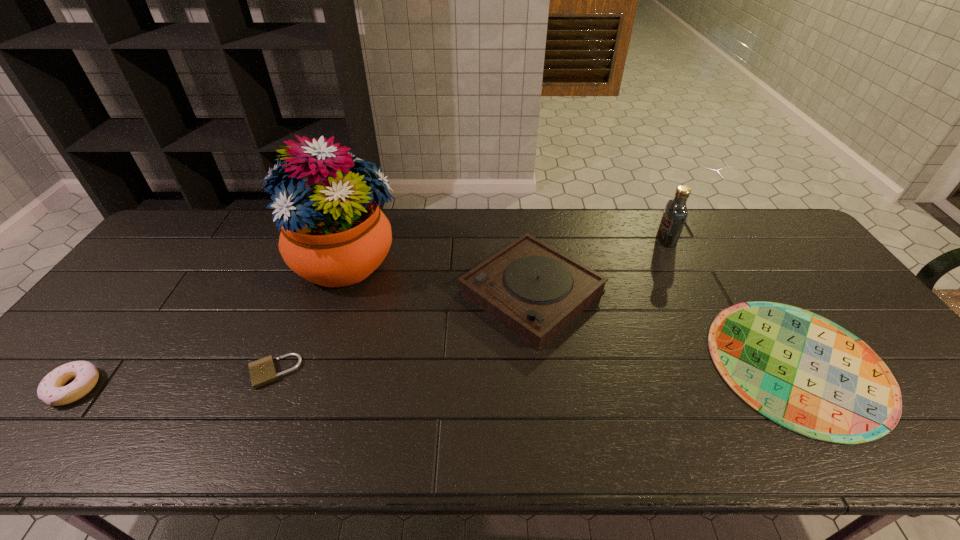
The image size is (960, 540). Identify the location of flower arrangement. (333, 233).

The height and width of the screenshot is (540, 960). What are the coordinates of `vodka` in the screenshot? It's located at (675, 214).

This screenshot has height=540, width=960. In order to click on the third object from right to left in this screenshot , I will do `click(534, 290)`.

You are a GUI agent. You are given a task and a screenshot of the screen. Output one action in this format:
    pyautogui.click(x=<x>, y=<y>)
    Task: Click on the phonograph record
    Image resolution: width=960 pixels, height=540 pixels.
    Given the screenshot: What is the action you would take?
    pyautogui.click(x=534, y=290)

Locate an element on the screen. doughnut is located at coordinates (51, 390).

Identify the location of the leftmost object. (51, 390).

The height and width of the screenshot is (540, 960). What are the coordinates of `the second shortest object` in the screenshot? It's located at (263, 371).

The width and height of the screenshot is (960, 540). I want to click on the shortest object, so click(802, 371).

The image size is (960, 540). What are the coordinates of `free space located on the right of the tallest object` in the screenshot? It's located at (494, 261).

Where is `free space located on the front-facing side of the vodka`? This screenshot has height=540, width=960. free space located on the front-facing side of the vodka is located at coordinates (558, 240).